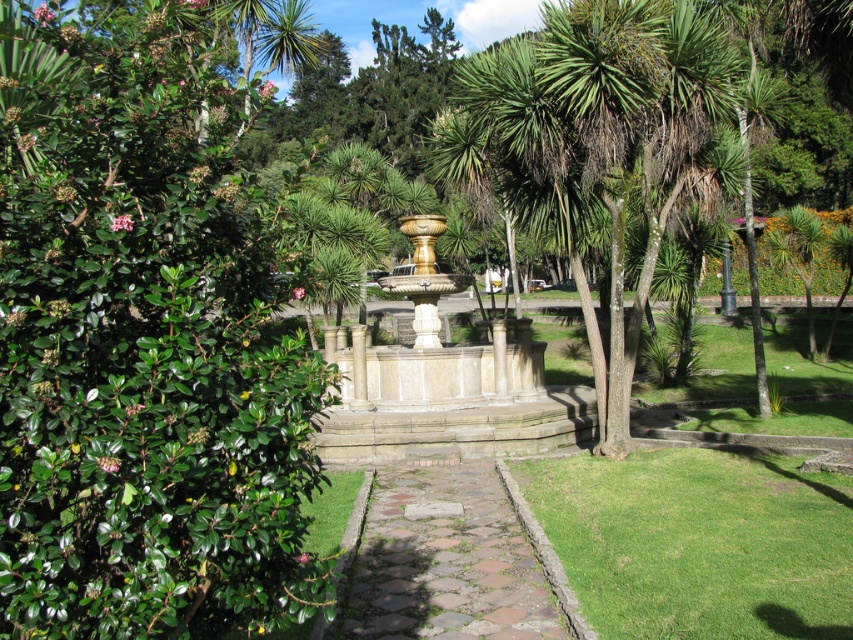
You are standing in the garden and want to take a photo of the gold polished stone fountain at center without any obstructions. The green leafy palm tree at center has leaves that might block the view. Can you determine if the palm tree will block the fountain in your photo?

The green leafy palm tree at center is taller than the gold polished stone fountain at center, so it may block the fountain in your photo depending on the angle and distance.

You are standing in the garden and want to take a photo of the green leafy palm tree at center. Where should you position yourself to capture it in the frame?

To capture the green leafy palm tree at center in the frame, position yourself so that the tree is centered at the coordinates approximately 0.227 along the horizontal axis and 0.698 along the vertical axis of the image.